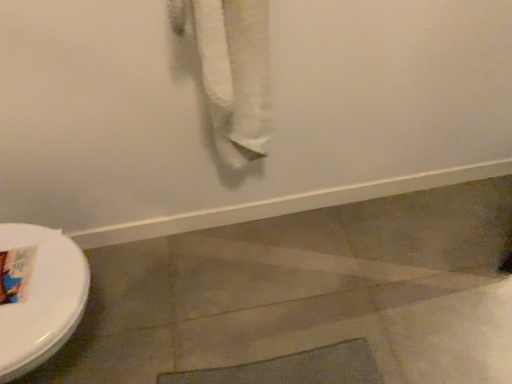
Question: Can you confirm if white cotton towel at upper center is taller than white glossy toilet at left?

Choices:
 (A) yes
 (B) no

Answer: (A)

Question: Is white cotton towel at upper center facing towards white glossy toilet at left?

Choices:
 (A) yes
 (B) no

Answer: (B)

Question: From a real-world perspective, is white cotton towel at upper center located beneath white glossy toilet at left?

Choices:
 (A) no
 (B) yes

Answer: (A)

Question: Considering the relative sizes of white cotton towel at upper center and white glossy toilet at left in the image provided, is white cotton towel at upper center smaller than white glossy toilet at left?

Choices:
 (A) yes
 (B) no

Answer: (A)

Question: From the image's perspective, does white cotton towel at upper center appear lower than white glossy toilet at left?

Choices:
 (A) no
 (B) yes

Answer: (A)

Question: Considering the relative sizes of white cotton towel at upper center and white glossy toilet at left in the image provided, is white cotton towel at upper center shorter than white glossy toilet at left?

Choices:
 (A) yes
 (B) no

Answer: (B)

Question: Is white glossy toilet at left positioned beyond the bounds of white cotton towel at upper center?

Choices:
 (A) no
 (B) yes

Answer: (B)

Question: Does white glossy toilet at left lie in front of white cotton towel at upper center?

Choices:
 (A) yes
 (B) no

Answer: (B)

Question: Does white glossy toilet at left turn towards white cotton towel at upper center?

Choices:
 (A) yes
 (B) no

Answer: (B)

Question: Does white glossy toilet at left have a lesser height compared to white cotton towel at upper center?

Choices:
 (A) yes
 (B) no

Answer: (A)

Question: From the image's perspective, is white glossy toilet at left located beneath white cotton towel at upper center?

Choices:
 (A) yes
 (B) no

Answer: (A)

Question: Considering the relative sizes of white glossy toilet at left and white cotton towel at upper center in the image provided, is white glossy toilet at left bigger than white cotton towel at upper center?

Choices:
 (A) no
 (B) yes

Answer: (B)

Question: In terms of size, does white cotton towel at upper center appear bigger or smaller than white glossy toilet at left?

Choices:
 (A) big
 (B) small

Answer: (B)